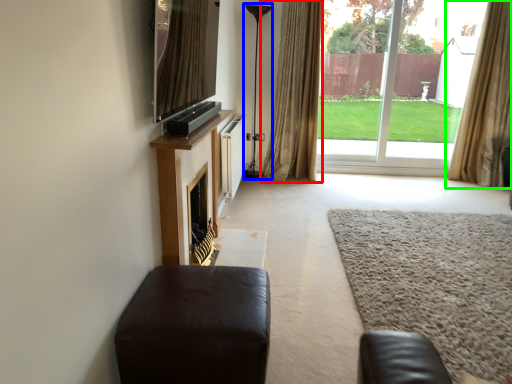
Question: Which object is positioned closest to curtain (highlighted by a red box)? Select from lamp (highlighted by a blue box) and curtain (highlighted by a green box).

Choices:
 (A) lamp
 (B) curtain

Answer: (A)